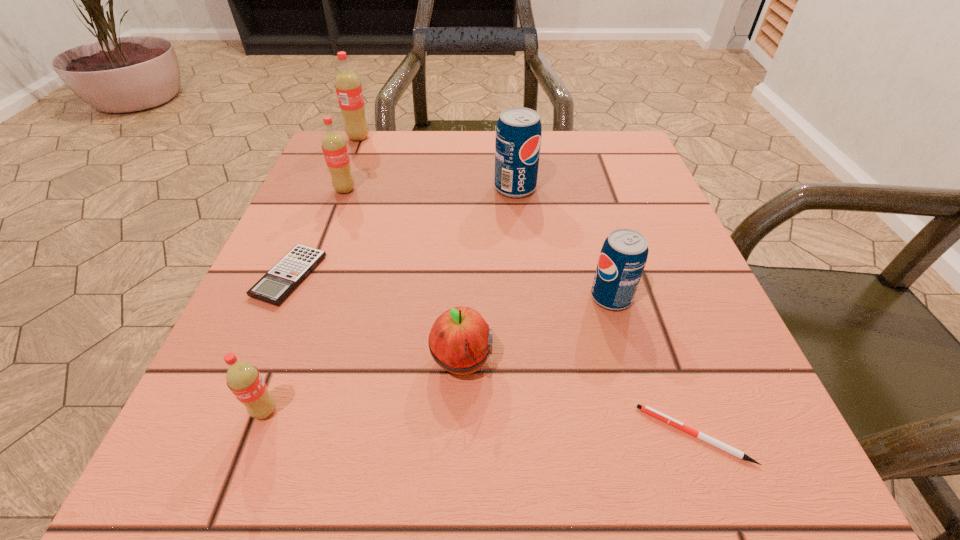
Where is `vacant region between the smallest red soda and the white pen`? This screenshot has height=540, width=960. vacant region between the smallest red soda and the white pen is located at coordinates (480, 423).

Where is `blank region between the white pen and the second shortest object`? Image resolution: width=960 pixels, height=540 pixels. blank region between the white pen and the second shortest object is located at coordinates (492, 355).

Where is `empty location between the shortest object and the farther blue pop`? The image size is (960, 540). empty location between the shortest object and the farther blue pop is located at coordinates (605, 311).

Identify the location of free space that is in between the nearest red soda and the second nearest red soda. This screenshot has height=540, width=960. (x=305, y=300).

Find the location of a particular element. The width and height of the screenshot is (960, 540). free space between the farthest red soda and the smaller blue pop is located at coordinates (485, 218).

Locate an element on the screen. free space that is in between the third nearest object and the farthest object is located at coordinates (410, 249).

Identify which object is the sixth closest to the seventh tallest object. Please provide its 2D coordinates. Your answer should be formatted as a tuple, i.e. [(x, y)], where the tuple contains the x and y coordinates of a point satisfying the conditions above.

[(623, 256)]

Identify which object is located as the second nearest to the second smallest red soda. Please provide its 2D coordinates. Your answer should be formatted as a tuple, i.e. [(x, y)], where the tuple contains the x and y coordinates of a point satisfying the conditions above.

[(349, 92)]

Point out which soda is positioned as the second nearest to the farthest red soda. Please provide its 2D coordinates. Your answer should be formatted as a tuple, i.e. [(x, y)], where the tuple contains the x and y coordinates of a point satisfying the conditions above.

[(518, 133)]

Locate an element on the screen. soda that stands as the second closest to the second biggest red soda is located at coordinates (518, 133).